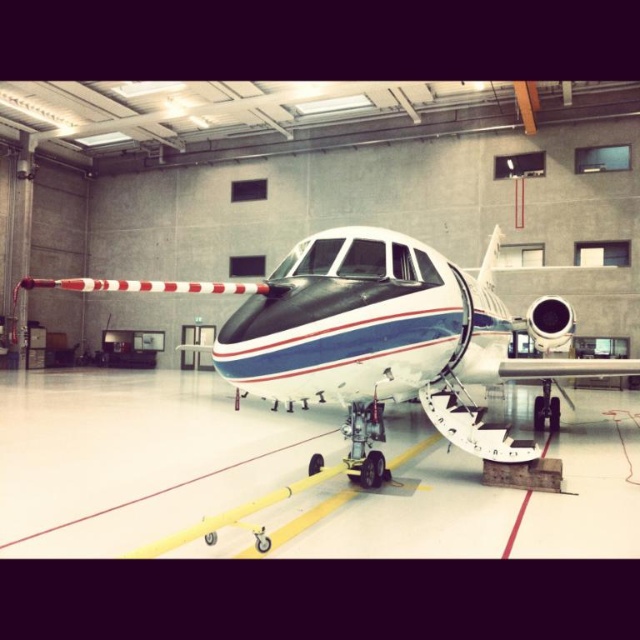
Does white glossy tarmac at center have a greater width compared to white glossy airplane at center?

Yes, white glossy tarmac at center is wider than white glossy airplane at center.

Is the position of white glossy tarmac at center less distant than that of white glossy airplane at center?

No.

This screenshot has width=640, height=640. In order to click on white glossy tarmac at center in this screenshot , I will do `click(138, 456)`.